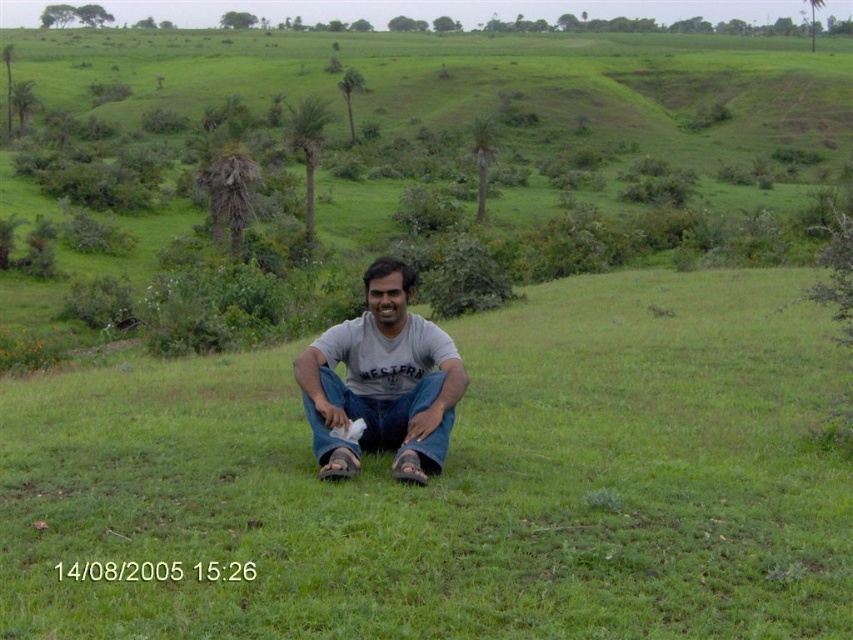
You are a hiker who wants to place a 3.5 meter long tent between the green grassy at center and the palm trees in the background. Can you fit the tent in that space?

The distance between the green grassy at center and the palm trees in the background is 4.17 meters. Since the tent is 3.5 meters long, it can fit comfortably within the available space.

What are the coordinates of the gray cotton shirt at center in the image?

The gray cotton shirt at center is located at coordinates point (381,381).

You are a photographer trying to capture the perfect shot of the person sitting on the green grassy at center and the jeans at center. Based on their positions, which object should you focus on first to ensure both are in frame?

The green grassy at center is located above jeans at center, so you should focus on the jeans at center first to ensure both are in frame.